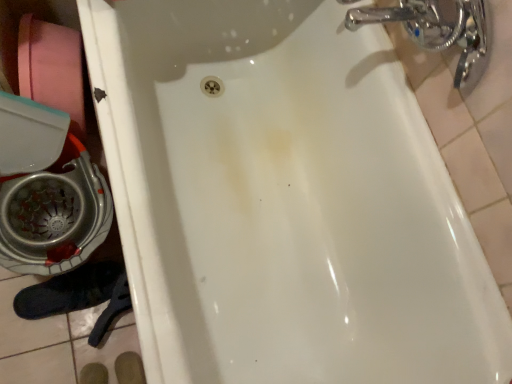
Question: Is point (51, 89) closer or farther from the camera than point (115, 279)?

Choices:
 (A) closer
 (B) farther

Answer: (A)

Question: In the image, is pink cardboard toilet paper at left on the left side or the right side of black suede shoe at lower left?

Choices:
 (A) right
 (B) left

Answer: (B)

Question: Estimate the real-world distances between objects in this image. Which object is closer to the chrome metallic faucet at upper right?

Choices:
 (A) pink cardboard toilet paper at left
 (B) black suede shoe at lower left

Answer: (A)

Question: Which object is the farthest from the black suede shoe at lower left?

Choices:
 (A) chrome metallic faucet at upper right
 (B) pink cardboard toilet paper at left

Answer: (A)